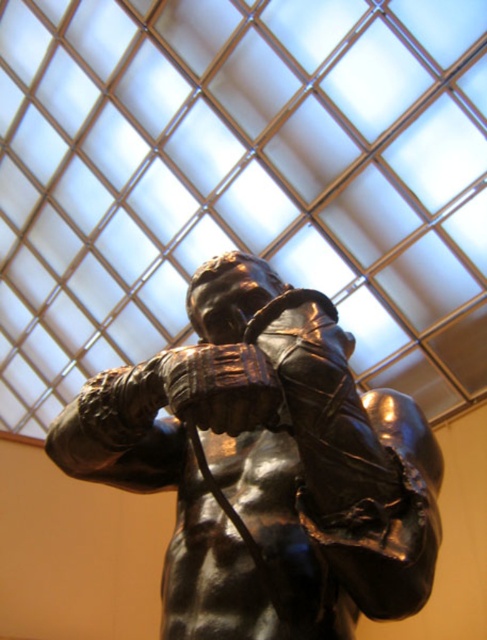
Who is more distant from viewer, (x=135, y=454) or (x=213, y=397)?

The point (x=135, y=454) is behind.

Between point (267, 561) and point (171, 369), which one is positioned in front?

Point (171, 369) is in front.

Is point (261, 333) positioned behind point (227, 374)?

Yes, point (261, 333) is farther from viewer.

Where is `shiny bronze statue at center`? shiny bronze statue at center is located at coordinates (267, 465).